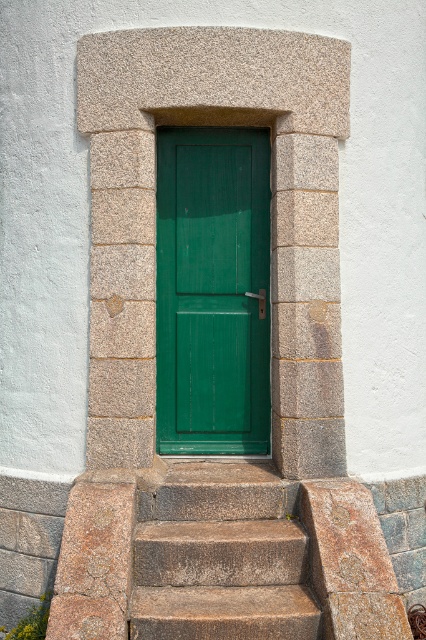
Question: Does green wooden door at center appear under granite steps at center?

Choices:
 (A) yes
 (B) no

Answer: (B)

Question: Which point is farther to the camera?

Choices:
 (A) (227, 388)
 (B) (271, 618)

Answer: (A)

Question: Does green wooden door at center have a lesser width compared to granite steps at center?

Choices:
 (A) no
 (B) yes

Answer: (B)

Question: Is green wooden door at center wider than granite steps at center?

Choices:
 (A) no
 (B) yes

Answer: (A)